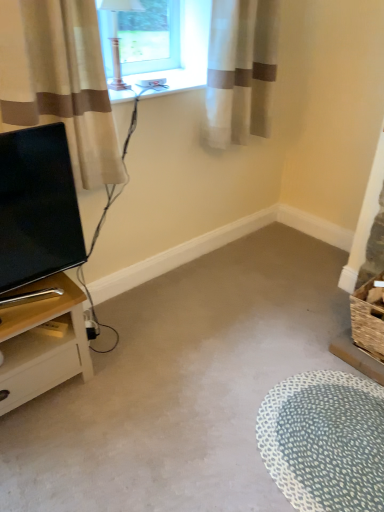
I want to click on free space above carpet at center (from a real-world perspective), so click(199, 396).